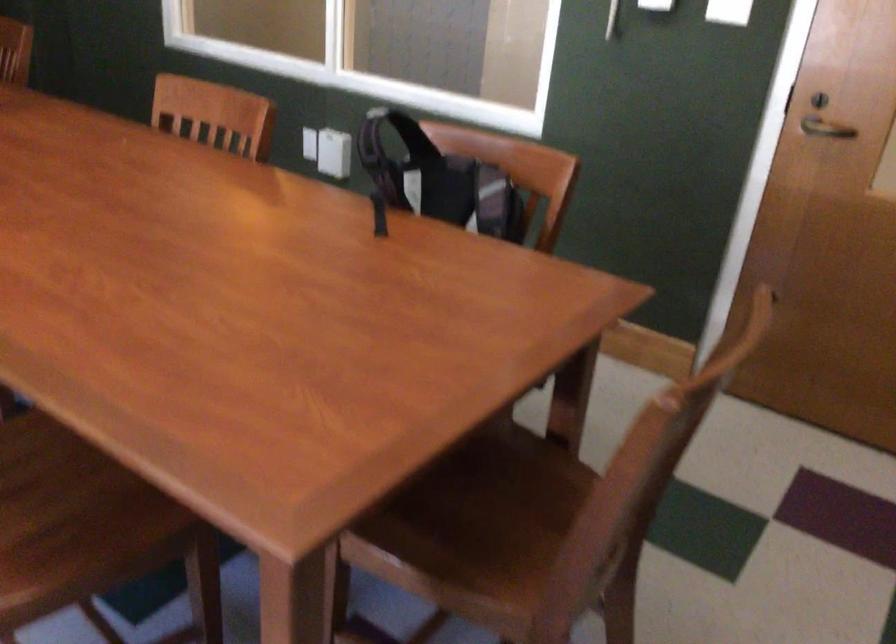
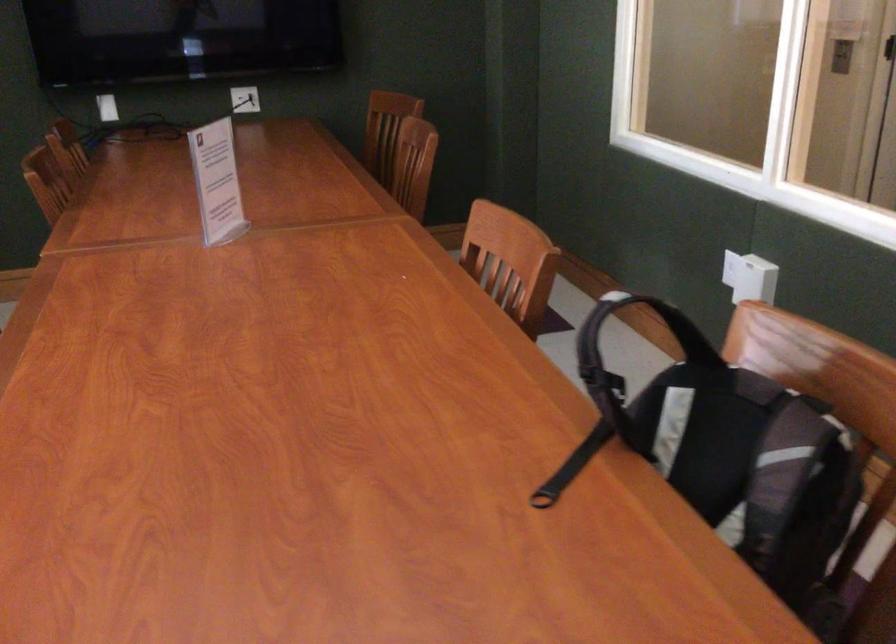
Find the pixel in the second image that matches point 326,138 in the first image.

(742, 269)